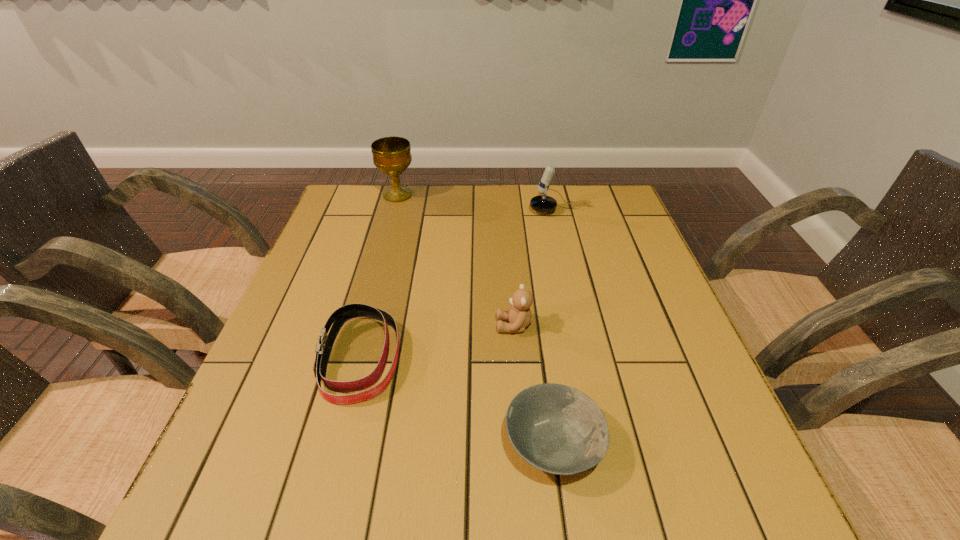
Locate an element on the screen. unoccupied area between the chalice and the teddy bear is located at coordinates (456, 260).

The width and height of the screenshot is (960, 540). Find the location of `free point between the dog collar and the bowl`. free point between the dog collar and the bowl is located at coordinates (457, 401).

What are the coordinates of `free space between the shortest object and the chalice` in the screenshot? It's located at (475, 319).

The width and height of the screenshot is (960, 540). Identify the location of vacant region between the chalice and the third shortest object. (456, 260).

At what (x,y) coordinates should I click in order to perform the action: click on vacant region between the teddy bear and the microphone. Please return your answer as a coordinate pair (x, y). The image size is (960, 540). Looking at the image, I should click on (539, 268).

Where is `object that stands as the closest to the bowl`? object that stands as the closest to the bowl is located at coordinates (519, 315).

Where is `the fourth closest object to the microphone`? Image resolution: width=960 pixels, height=540 pixels. the fourth closest object to the microphone is located at coordinates (557, 429).

This screenshot has height=540, width=960. I want to click on free space that satisfies the following two spatial constraints: 1. on the front-facing side of the teddy bear; 2. on the back side of the bowl, so click(x=523, y=444).

Identify the location of vacant position in the image that satisfies the following two spatial constraints: 1. on the front side of the microphone; 2. on the front-facing side of the third tallest object. (591, 326).

The height and width of the screenshot is (540, 960). I want to click on blank space that satisfies the following two spatial constraints: 1. on the front-facing side of the bowl; 2. on the right side of the third shortest object, so click(x=523, y=444).